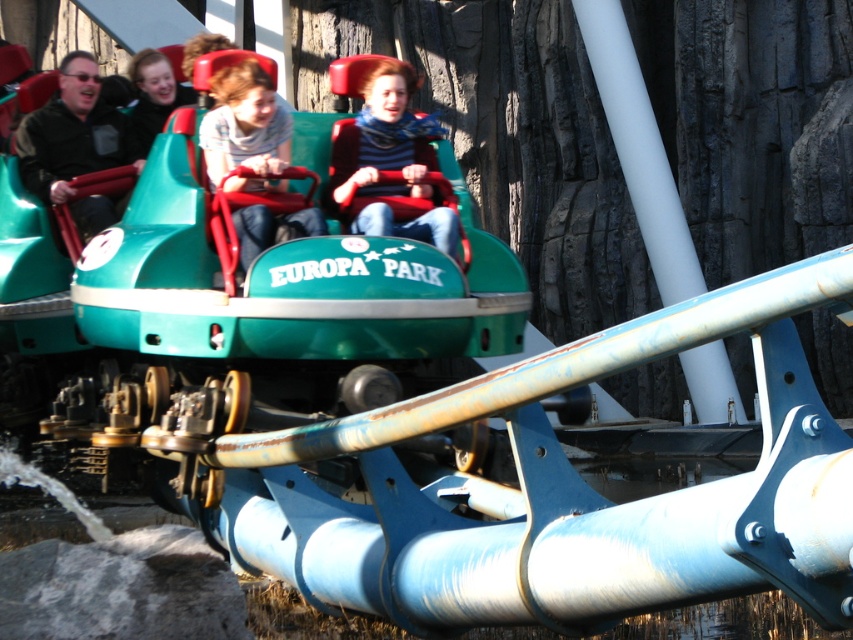
Question: In this image, where is green matte bumper car at center located relative to matte blue scarf at center?

Choices:
 (A) right
 (B) left

Answer: (B)

Question: Which object is the farthest from the matte black jacket at left?

Choices:
 (A) matte blue jeans at center
 (B) matte blue scarf at center

Answer: (B)

Question: Is matte black jacket at left to the left of matte blue jeans at center from the viewer's perspective?

Choices:
 (A) yes
 (B) no

Answer: (A)

Question: Which point is farther to the camera?

Choices:
 (A) matte black jacket at upper left
 (B) matte blue jeans at center
 (C) matte black jacket at left
 (D) matte blue scarf at center

Answer: (A)

Question: From the image, what is the correct spatial relationship of green matte bumper car at center in relation to matte blue jeans at center?

Choices:
 (A) right
 (B) left

Answer: (B)

Question: Which of the following is the farthest from the observer?

Choices:
 (A) matte blue jeans at center
 (B) green matte bumper car at center
 (C) matte black jacket at upper left
 (D) matte black jacket at left

Answer: (C)